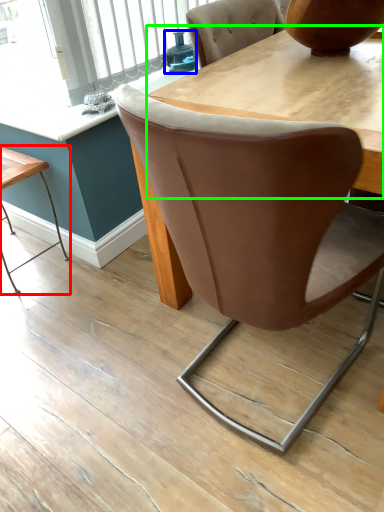
Question: Based on their relative distances, which object is farther from table (highlighted by a red box)? Choose from teal (highlighted by a blue box) and round table (highlighted by a green box).

Choices:
 (A) teal
 (B) round table

Answer: (B)